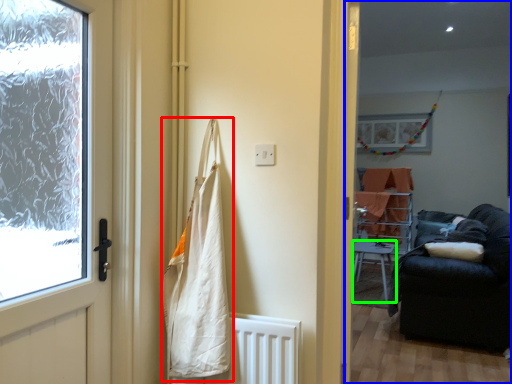
Question: Which object is positioned farthest from shopping bag (highlighted by a red box)? Select from corridor (highlighted by a blue box) and furniture (highlighted by a green box).

Choices:
 (A) corridor
 (B) furniture

Answer: (A)